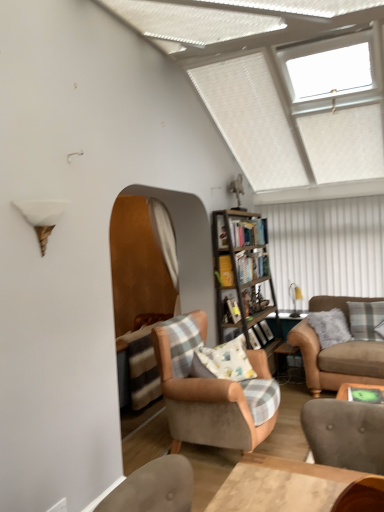
Question: Is green felt table at lower right further to the viewer compared to white plastic window at upper right?

Choices:
 (A) yes
 (B) no

Answer: (B)

Question: Is green felt table at lower right facing away from white plastic window at upper right?

Choices:
 (A) yes
 (B) no

Answer: (B)

Question: From a real-world perspective, is green felt table at lower right positioned under white plastic window at upper right based on gravity?

Choices:
 (A) yes
 (B) no

Answer: (A)

Question: Is green felt table at lower right next to white plastic window at upper right and touching it?

Choices:
 (A) yes
 (B) no

Answer: (B)

Question: Is green felt table at lower right to the left of white plastic window at upper right from the viewer's perspective?

Choices:
 (A) no
 (B) yes

Answer: (A)

Question: Can you confirm if green felt table at lower right is taller than white plastic window at upper right?

Choices:
 (A) yes
 (B) no

Answer: (B)

Question: Is suede brown couch at right placed right next to white plastic window at upper right?

Choices:
 (A) no
 (B) yes

Answer: (A)

Question: Considering the relative sizes of suede brown couch at right and white plastic window at upper right in the image provided, is suede brown couch at right smaller than white plastic window at upper right?

Choices:
 (A) yes
 (B) no

Answer: (B)

Question: Can you confirm if suede brown couch at right is bigger than white plastic window at upper right?

Choices:
 (A) yes
 (B) no

Answer: (A)

Question: Is suede brown couch at right outside white plastic window at upper right?

Choices:
 (A) yes
 (B) no

Answer: (A)

Question: Does suede brown couch at right lie in front of white plastic window at upper right?

Choices:
 (A) yes
 (B) no

Answer: (B)

Question: Is suede brown couch at right far away from white plastic window at upper right?

Choices:
 (A) yes
 (B) no

Answer: (A)

Question: Is wooden bookshelf at center completely or partially outside of metallic silver side table at lower right?

Choices:
 (A) yes
 (B) no

Answer: (A)